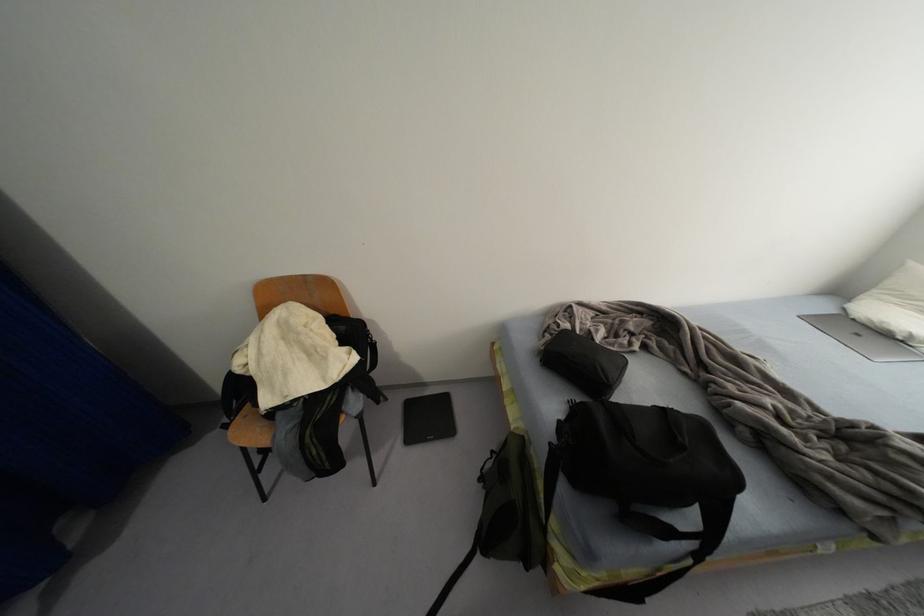
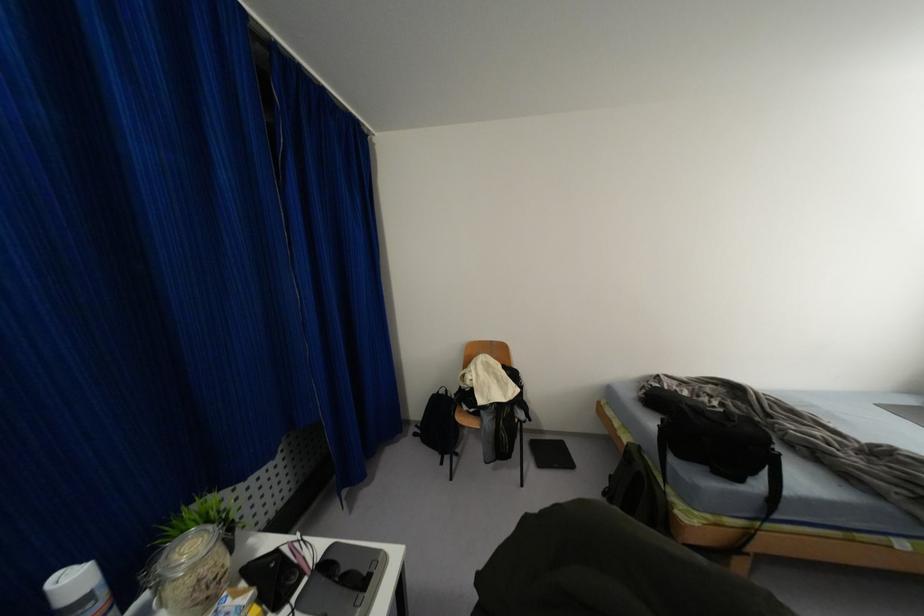
The images are taken continuously from a first-person perspective. In which direction are you moving?

The cameraman moved toward left, backward.